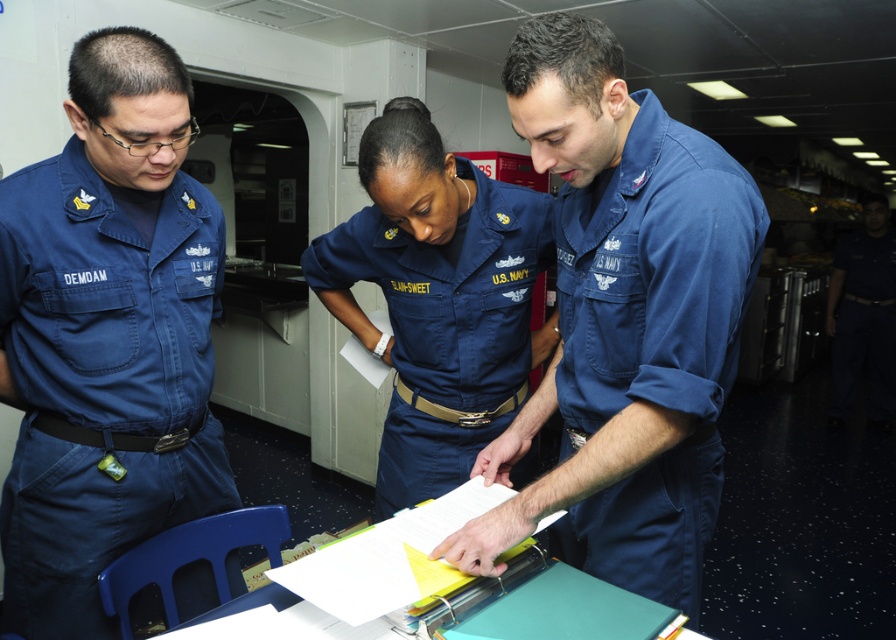
Does blue cotton shirt at left appear on the left side of blue cotton shirt at center?

Correct, you'll find blue cotton shirt at left to the left of blue cotton shirt at center.

Is the position of blue cotton shirt at left less distant than that of blue cotton shirt at center?

No.

Who is more forward, (109, 273) or (687, 497)?

Answer: Point (687, 497) is more forward.

Find the location of `blue cotton shirt at left`. blue cotton shirt at left is located at coordinates (102, 380).

Is point (204, 330) closer to viewer compared to point (451, 179)?

Yes, point (204, 330) is in front of point (451, 179).

Is point (110, 348) more distant than point (493, 225)?

No, it is in front of (493, 225).

Locate an element on the screen. The height and width of the screenshot is (640, 896). blue cotton shirt at left is located at coordinates (102, 380).

Is blue cotton shirt at center bigger than navy blue fabric uniform at center?

Actually, blue cotton shirt at center might be smaller than navy blue fabric uniform at center.

Who is more distant from viewer, (639, 387) or (419, 500)?

The point (419, 500) is behind.

Does point (623, 176) come behind point (403, 314)?

No, it is not.

Where is `blue cotton shirt at center`? blue cotton shirt at center is located at coordinates (653, 342).